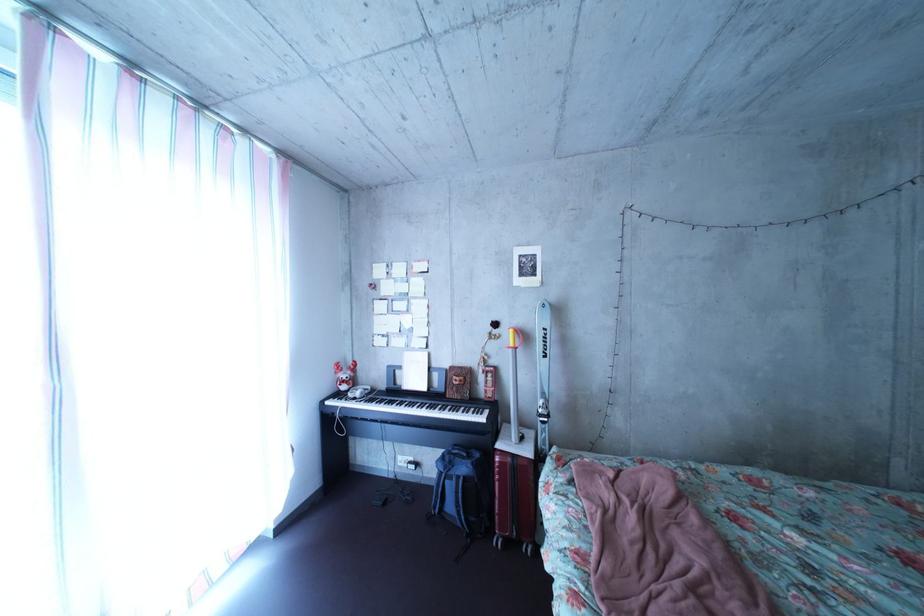
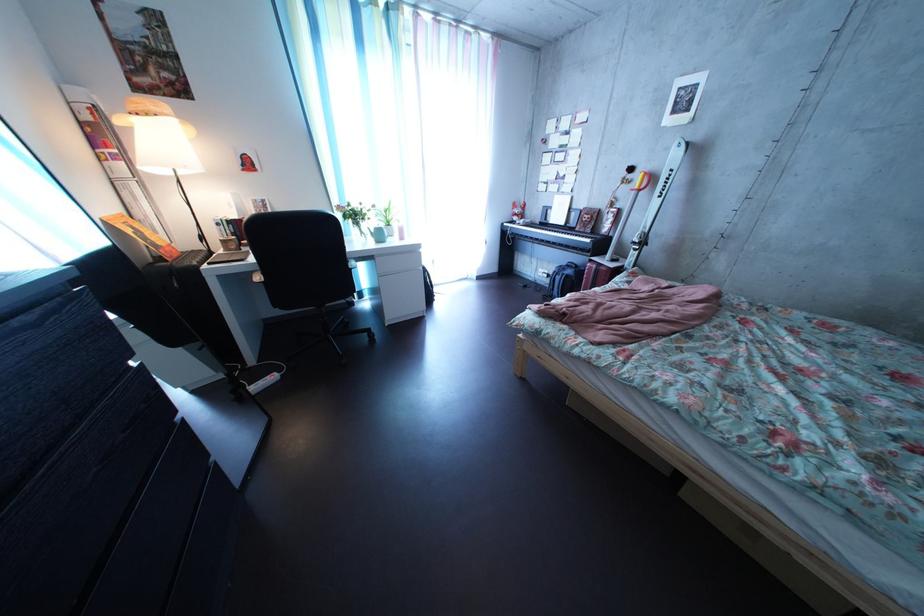
Locate, in the second image, the point that corresponds to pixel 403 454 in the first image.

(550, 269)